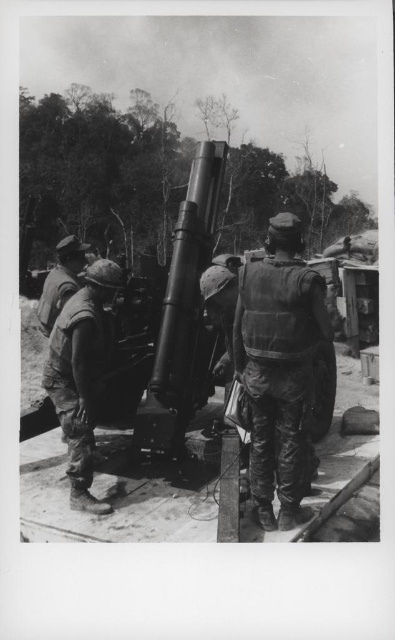
You are a soldier in the scene and need to quickly access your vest. Which item is positioned closer to you, the camouflage fabric vest at center or the camouflage fabric uniform at center?

The camouflage fabric vest at center is closer to the viewer than the camouflage fabric uniform at center, so you can quickly access the camouflage fabric vest at center.

In the scene, there are a camouflage fabric uniform at center and a camouflage fabric helmet at center. Which one is smaller in size?

The camouflage fabric uniform at center is smaller in size compared to the camouflage fabric helmet at center.